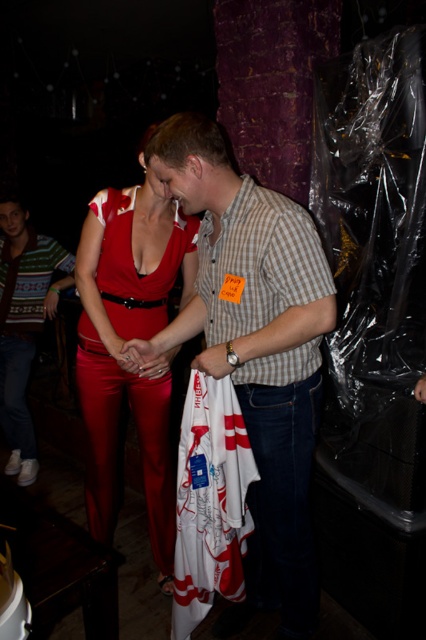
Question: Can you confirm if brown checkered shirt at center is smaller than matte red pants at center?

Choices:
 (A) yes
 (B) no

Answer: (B)

Question: Which object is closer to the camera taking this photo?

Choices:
 (A) matte red dress at center
 (B) striped knit sweater at left

Answer: (A)

Question: Among these points, which one is farthest from the camera?

Choices:
 (A) (267, 467)
 (B) (129, 387)

Answer: (B)

Question: Is matte red dress at center wider than brown checkered shirt at center?

Choices:
 (A) no
 (B) yes

Answer: (B)

Question: Which point appears closest to the camera in this image?

Choices:
 (A) (264, 252)
 (B) (178, 161)
 (C) (25, 413)
 (D) (134, 362)

Answer: (A)

Question: In this image, where is brown checkered shirt at center located relative to matte red pants at center?

Choices:
 (A) above
 (B) below

Answer: (A)